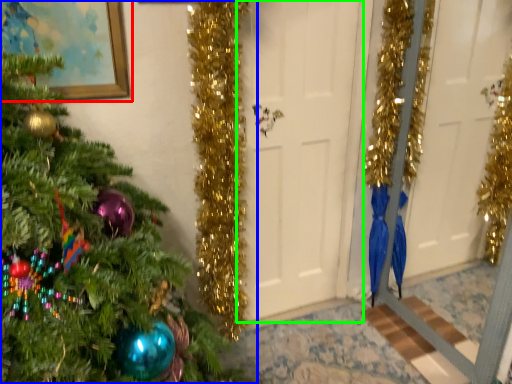
Question: Which is nearer to the picture frame (highlighted by a red box)? christmas tree (highlighted by a blue box) or door (highlighted by a green box).

Choices:
 (A) christmas tree
 (B) door

Answer: (A)